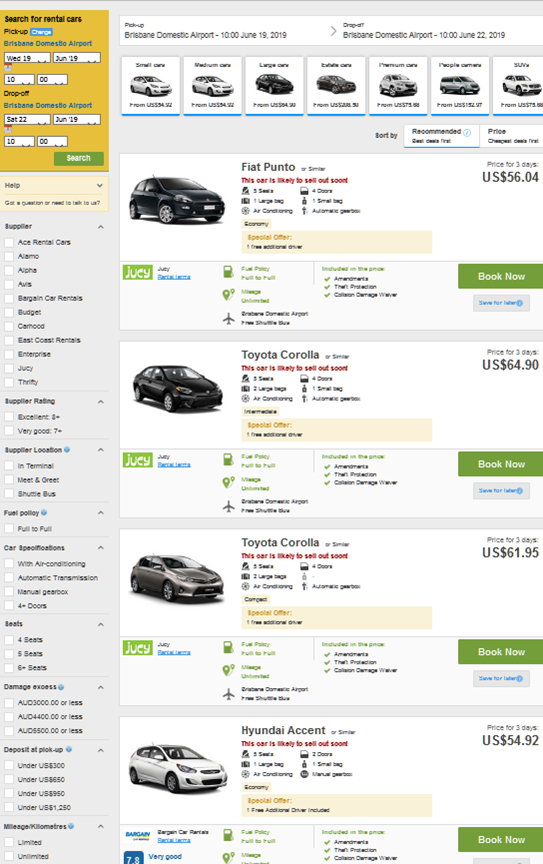
Locate an element on the screen. The height and width of the screenshot is (864, 543). seats is located at coordinates [7, 639], [11, 653], [11, 670].